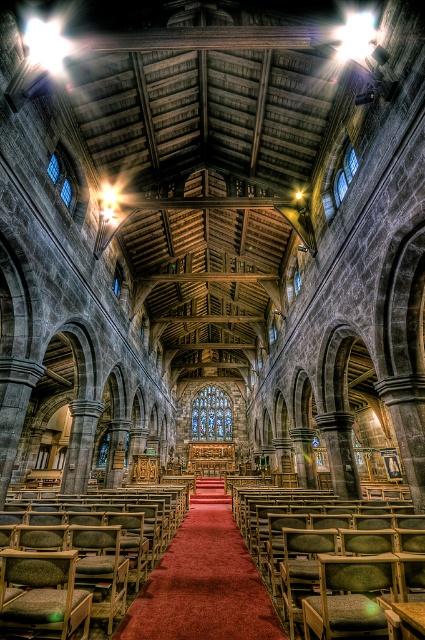
Question: Among these points, which one is farthest from the camera?

Choices:
 (A) (371, 525)
 (B) (289, 292)
 (C) (229, 429)

Answer: (C)

Question: Does wooden textured bench at center appear over transparent stained glass window at upper center?

Choices:
 (A) no
 (B) yes

Answer: (A)

Question: Does carpeted aisle at center have a larger size compared to clear glass window at upper left?

Choices:
 (A) no
 (B) yes

Answer: (B)

Question: Which of these objects is positioned farthest from the stained glass window at center?

Choices:
 (A) wooden textured bench at center
 (B) clear glass window at upper left
 (C) clear glass window at upper center
 (D) transparent stained glass window at upper center

Answer: (B)

Question: Does carpeted aisle at center come in front of clear glass window at upper center?

Choices:
 (A) yes
 (B) no

Answer: (A)

Question: Which of these objects is positioned closest to the clear glass window at upper center?

Choices:
 (A) transparent stained glass window at upper center
 (B) stained glass window at center

Answer: (A)